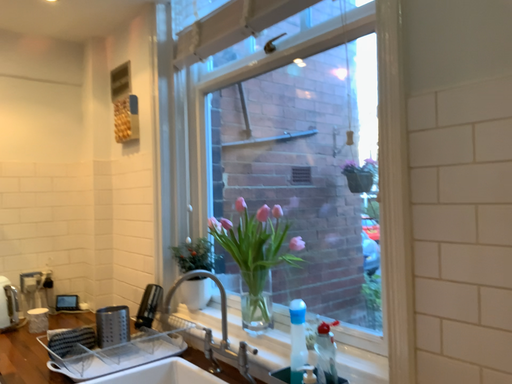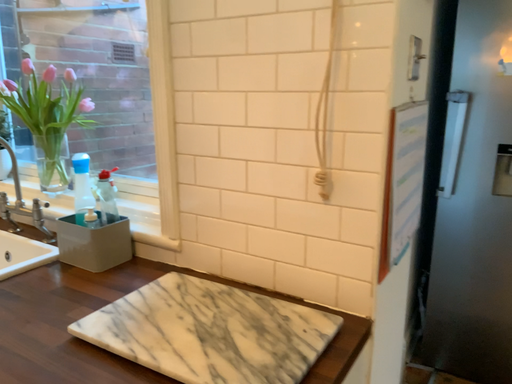
Question: How did the camera likely rotate when shooting the video?

Choices:
 (A) rotated left
 (B) rotated right

Answer: (B)